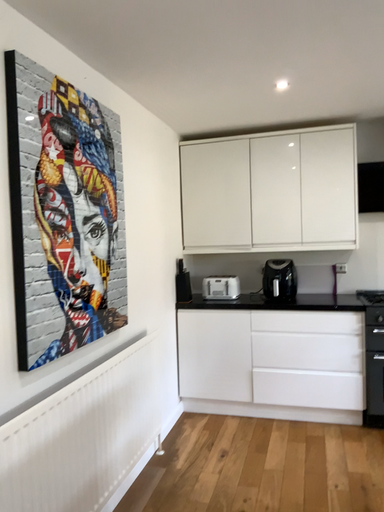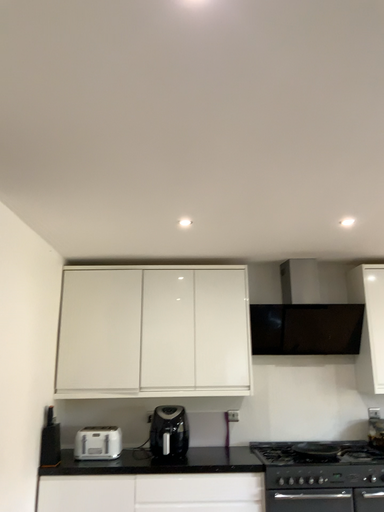
Question: How did the camera likely rotate when shooting the video?

Choices:
 (A) rotated left
 (B) rotated right

Answer: (B)